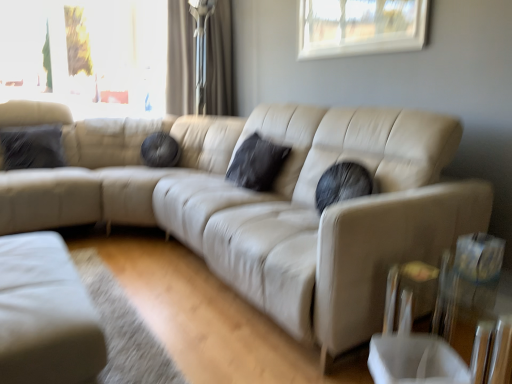
The width and height of the screenshot is (512, 384). What do you see at coordinates (180, 59) in the screenshot? I see `matte beige curtain at upper center` at bounding box center [180, 59].

The image size is (512, 384). What do you see at coordinates (360, 27) in the screenshot?
I see `transparent glass window at upper center` at bounding box center [360, 27].

I want to click on matte beige curtain at upper center, so click(180, 59).

Considering the relative sizes of velvet dark gray pillow at left, which is the 2th pillow from right to left, and transparent glass window at upper center in the image provided, is velvet dark gray pillow at left, which is the 2th pillow from right to left, smaller than transparent glass window at upper center?

No.

Is velvet dark gray pillow at left, which is the 2th pillow from right to left, spatially inside transparent glass window at upper center, or outside of it?

velvet dark gray pillow at left, which is the 2th pillow from right to left, cannot be found inside transparent glass window at upper center.

Does velvet dark gray pillow at left, which is the 2th pillow from right to left, have a greater width compared to transparent glass window at upper center?

Yes, velvet dark gray pillow at left, which is the 2th pillow from right to left, is wider than transparent glass window at upper center.

Could you measure the distance between velvet dark gray pillow at left, the first pillow viewed from the left, and transparent glass window at upper center?

The distance of velvet dark gray pillow at left, the first pillow viewed from the left, from transparent glass window at upper center is 2.26 meters.

From the picture: From a real-world perspective, is transparent glass window at upper center positioned over beige leather couch at center based on gravity?

Yes, from a real-world perspective, transparent glass window at upper center is above beige leather couch at center.

Measure the distance between transparent glass window at upper center and beige leather couch at center.

transparent glass window at upper center is 3.33 feet from beige leather couch at center.

The height and width of the screenshot is (384, 512). In order to click on window above the beige leather couch at center (from a real-world perspective) in this screenshot , I will do [x=360, y=27].

From the image's perspective, is transparent glass window at upper center below beige leather couch at center?

No, from the image's perspective, transparent glass window at upper center is not beneath beige leather couch at center.

Identify the location of studio couch that appears below the matte beige curtain at upper center (from a real-world perspective). This screenshot has height=384, width=512. pos(266,203).

Is matte beige curtain at upper center bigger than beige leather couch at center?

No.

Does matte beige curtain at upper center appear on the left side of beige leather couch at center?

Correct, you'll find matte beige curtain at upper center to the left of beige leather couch at center.

Is matte beige curtain at upper center aimed at beige leather couch at center?

Yes, matte beige curtain at upper center faces towards beige leather couch at center.

In the scene shown: Is transparent glass window at upper center in front of or behind transparent glass table at lower right in the image?

Clearly, transparent glass window at upper center is behind transparent glass table at lower right.

From a real-world perspective, is transparent glass window at upper center located higher than transparent glass table at lower right?

Yes, from a real-world perspective, transparent glass window at upper center is above transparent glass table at lower right.

From the picture: Visually, is transparent glass window at upper center positioned to the left or to the right of transparent glass table at lower right?

In the image, transparent glass window at upper center appears on the left side of transparent glass table at lower right.

In the scene shown: Is transparent glass window at upper center to the left of black matte pillow at center, the 1th pillow positioned from the right, from the viewer's perspective?

In fact, transparent glass window at upper center is to the right of black matte pillow at center, the 1th pillow positioned from the right.

In terms of width, does transparent glass window at upper center look wider or thinner when compared to black matte pillow at center, the 1th pillow positioned from the right?

In the image, transparent glass window at upper center appears to be more narrow than black matte pillow at center, the 1th pillow positioned from the right.

Relative to black matte pillow at center, the 2th pillow positioned from the left, is transparent glass window at upper center in front or behind?

transparent glass window at upper center is in front of black matte pillow at center, the 2th pillow positioned from the left.

Is the surface of transparent glass window at upper center in direct contact with black matte pillow at center, the 2th pillow positioned from the left?

No, transparent glass window at upper center is not with black matte pillow at center, the 2th pillow positioned from the left.

Can you confirm if transparent glass table at lower right is thinner than beige leather couch at center?

Correct, the width of transparent glass table at lower right is less than that of beige leather couch at center.

Does transparent glass table at lower right lie in front of beige leather couch at center?

Yes, it is in front of beige leather couch at center.

From a real-world perspective, does transparent glass table at lower right stand above beige leather couch at center?

Actually, transparent glass table at lower right is physically below beige leather couch at center in the real world.

Are transparent glass table at lower right and beige leather couch at center far apart?

No, there isn't a large distance between transparent glass table at lower right and beige leather couch at center.

Is black matte pillow at center, the 2th pillow positioned from the left, thinner than transparent glass table at lower right?

Yes.

Locate an element on the screen. The image size is (512, 384). pillow that is the 1st object located behind the transparent glass table at lower right is located at coordinates (257, 163).

In the scene shown: Which is more to the right, black matte pillow at center, the 2th pillow positioned from the left, or transparent glass table at lower right?

From the viewer's perspective, transparent glass table at lower right appears more on the right side.

Considering the points (281, 146) and (401, 318), which point is in front, point (281, 146) or point (401, 318)?

The point (401, 318) is closer.

This screenshot has width=512, height=384. What are the coordinates of `window in front of the velvet dark gray pillow at left, the first pillow viewed from the left` in the screenshot? It's located at (360, 27).

This screenshot has height=384, width=512. In order to click on window on the right of beige leather couch at center in this screenshot , I will do `click(360, 27)`.

Based on their spatial positions, is transparent glass window at upper center or black matte pillow at center, the 1th pillow positioned from the right, further from velvet dark gray pillow at left, the first pillow viewed from the left?

transparent glass window at upper center is further to velvet dark gray pillow at left, the first pillow viewed from the left.

Estimate the real-world distances between objects in this image. Which object is closer to velvet dark gray pillow at left, which is the 2th pillow from right to left, transparent glass window at upper center or beige leather couch at center?

beige leather couch at center.

Which object lies further to the anchor point matte beige curtain at upper center, transparent glass table at lower right or velvet dark gray pillow at left, which is the 2th pillow from right to left?

transparent glass table at lower right is further to matte beige curtain at upper center.

Looking at the image, which one is located closer to transparent glass table at lower right, beige leather couch at center or matte beige curtain at upper center?

beige leather couch at center is positioned closer to the anchor transparent glass table at lower right.

When comparing their distances from transparent glass window at upper center, does black matte pillow at center, the 2th pillow positioned from the left, or beige leather couch at center seem closer?

black matte pillow at center, the 2th pillow positioned from the left, lies closer to transparent glass window at upper center than the other object.

Based on their spatial positions, is transparent glass window at upper center or black matte pillow at center, the 2th pillow positioned from the left, closer to matte beige curtain at upper center?

transparent glass window at upper center is positioned closer to the anchor matte beige curtain at upper center.

Based on their spatial positions, is beige leather couch at center or matte beige curtain at upper center further from velvet dark gray pillow at left, which is the 2th pillow from right to left?

matte beige curtain at upper center.

When comparing their distances from black matte pillow at center, the 1th pillow positioned from the right, does transparent glass table at lower right or matte beige curtain at upper center seem closer?

transparent glass table at lower right lies closer to black matte pillow at center, the 1th pillow positioned from the right, than the other object.

Identify the location of pillow between velvet dark gray pillow at left, which is the 2th pillow from right to left, and beige leather couch at center. The height and width of the screenshot is (384, 512). (257, 163).

The height and width of the screenshot is (384, 512). I want to click on window situated between velvet dark gray pillow at left, which is the 2th pillow from right to left, and transparent glass table at lower right from left to right, so click(x=360, y=27).

What are the coordinates of `studio couch between transparent glass window at upper center and transparent glass table at lower right from top to bottom` in the screenshot? It's located at (266, 203).

This screenshot has height=384, width=512. What are the coordinates of `pillow situated between velvet dark gray pillow at left, the first pillow viewed from the left, and transparent glass window at upper center from left to right` in the screenshot? It's located at (257, 163).